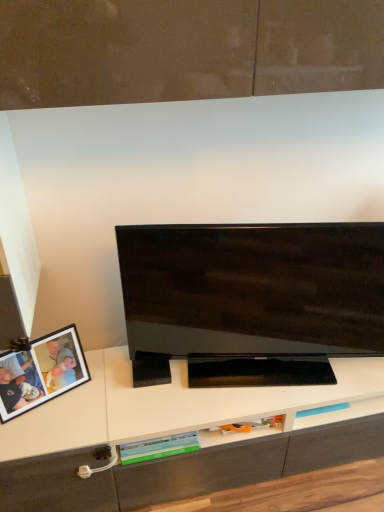
Question: In terms of size, does glossy black tv at center appear bigger or smaller than matte black photo frame at lower left?

Choices:
 (A) big
 (B) small

Answer: (A)

Question: Considering the relative positions of glossy black tv at center and matte black photo frame at lower left in the image provided, is glossy black tv at center to the left or to the right of matte black photo frame at lower left?

Choices:
 (A) right
 (B) left

Answer: (A)

Question: Is point (380, 233) positioned closer to the camera than point (43, 385)?

Choices:
 (A) closer
 (B) farther

Answer: (A)

Question: In terms of width, does matte black photo frame at lower left look wider or thinner when compared to glossy black tv at center?

Choices:
 (A) wide
 (B) thin

Answer: (B)

Question: From a real-world perspective, relative to glossy black tv at center, is matte black photo frame at lower left vertically above or below?

Choices:
 (A) below
 (B) above

Answer: (A)

Question: Is point (56, 348) closer or farther from the camera than point (352, 245)?

Choices:
 (A) farther
 (B) closer

Answer: (A)

Question: From the image's perspective, is matte black photo frame at lower left located above or below glossy black tv at center?

Choices:
 (A) above
 (B) below

Answer: (B)